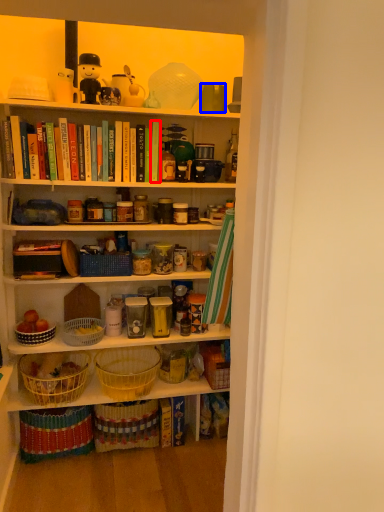
Question: Which of the following is the closest to the observer, book (highlighted by a red box) or coffee cup (highlighted by a blue box)?

Choices:
 (A) book
 (B) coffee cup

Answer: (B)